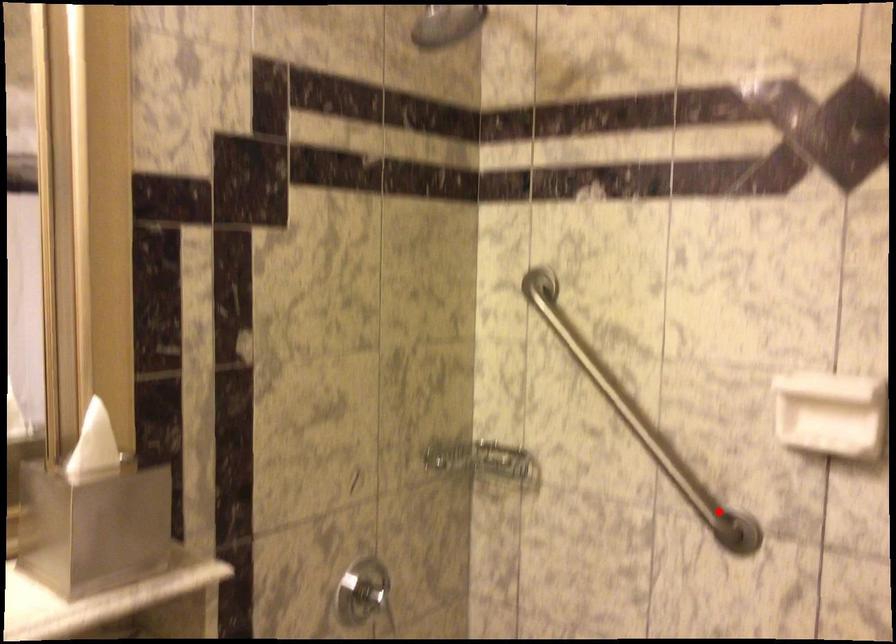
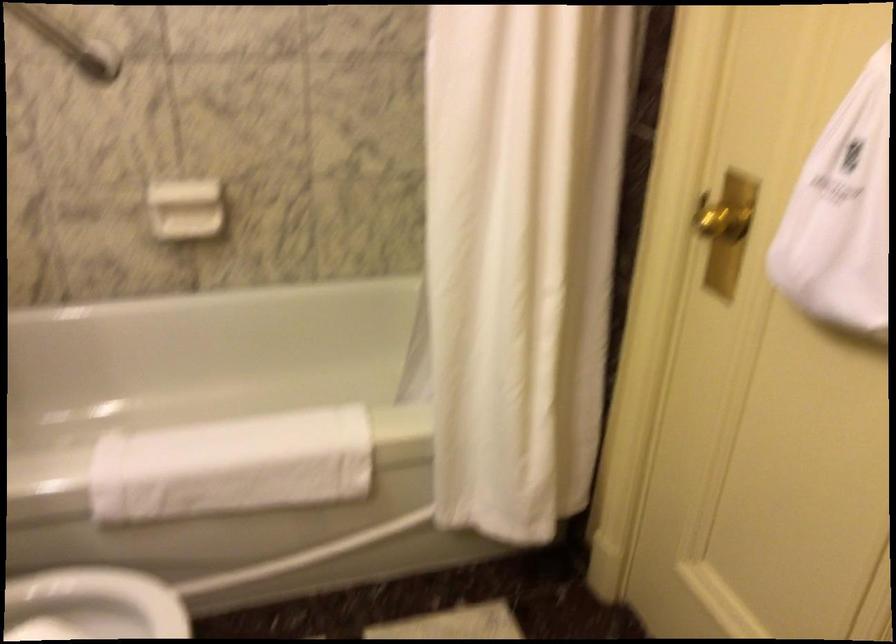
Question: I am providing you with two images of the same scene from different viewpoints. A red point is shown in image1. For the corresponding object point in image2, is it positioned nearer or farther from the camera?

Choices:
 (A) Nearer
 (B) Farther

Answer: (B)